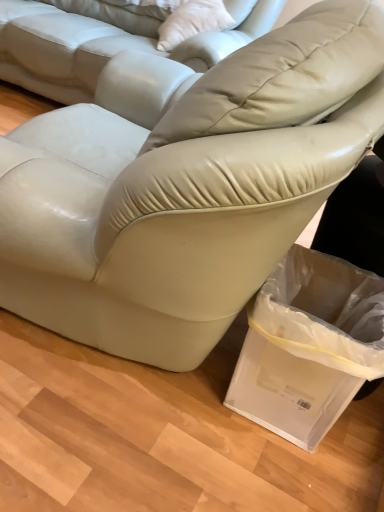
Question: From a real-world perspective, is clear plastic bag at lower right below matte leather couch at center, the second studio couch viewed from the top?

Choices:
 (A) no
 (B) yes

Answer: (A)

Question: Are clear plastic bag at lower right and matte leather couch at center, the second studio couch viewed from the top, located far from each other?

Choices:
 (A) no
 (B) yes

Answer: (A)

Question: Considering the relative positions of clear plastic bag at lower right and matte leather couch at center, the second studio couch viewed from the top, in the image provided, is clear plastic bag at lower right behind matte leather couch at center, the second studio couch viewed from the top,?

Choices:
 (A) yes
 (B) no

Answer: (A)

Question: From a real-world perspective, does clear plastic bag at lower right stand above matte leather couch at center, the second studio couch viewed from the top?

Choices:
 (A) yes
 (B) no

Answer: (A)

Question: Is clear plastic bag at lower right looking in the opposite direction of matte leather couch at center, the second studio couch viewed from the top?

Choices:
 (A) yes
 (B) no

Answer: (B)

Question: From their relative heights in the image, would you say white leather pillow at upper center is taller or shorter than satin beige leather couch at center, which is the second studio couch in bottom-to-top order?

Choices:
 (A) tall
 (B) short

Answer: (B)

Question: From the image's perspective, is white leather pillow at upper center located above or below satin beige leather couch at center, acting as the first studio couch starting from the top?

Choices:
 (A) above
 (B) below

Answer: (B)

Question: Considering the positions of point (177, 13) and point (44, 87), is point (177, 13) closer or farther from the camera than point (44, 87)?

Choices:
 (A) closer
 (B) farther

Answer: (A)

Question: Is white leather pillow at upper center in front of or behind satin beige leather couch at center, which is the second studio couch in bottom-to-top order, in the image?

Choices:
 (A) behind
 (B) front

Answer: (A)

Question: Considering the positions of point (198, 53) and point (162, 24), is point (198, 53) closer or farther from the camera than point (162, 24)?

Choices:
 (A) farther
 (B) closer

Answer: (B)

Question: Considering their positions, is satin beige leather couch at center, acting as the first studio couch starting from the top, located in front of or behind white leather pillow at upper center?

Choices:
 (A) front
 (B) behind

Answer: (A)

Question: Based on their positions, is satin beige leather couch at center, acting as the first studio couch starting from the top, located to the left or right of white leather pillow at upper center?

Choices:
 (A) right
 (B) left

Answer: (B)

Question: Looking at their shapes, would you say satin beige leather couch at center, acting as the first studio couch starting from the top, is wider or thinner than white leather pillow at upper center?

Choices:
 (A) thin
 (B) wide

Answer: (B)

Question: In terms of size, does matte leather couch at center, positioned as the first studio couch in bottom-to-top order, appear bigger or smaller than satin beige leather couch at center, acting as the first studio couch starting from the top?

Choices:
 (A) big
 (B) small

Answer: (B)

Question: From a real-world perspective, is matte leather couch at center, the second studio couch viewed from the top, positioned above or below satin beige leather couch at center, which is the second studio couch in bottom-to-top order?

Choices:
 (A) above
 (B) below

Answer: (B)